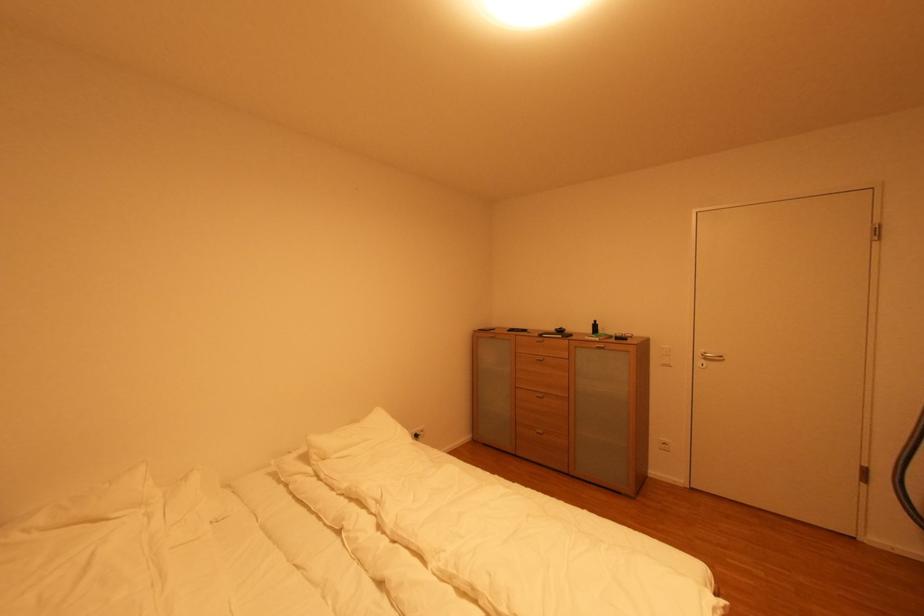
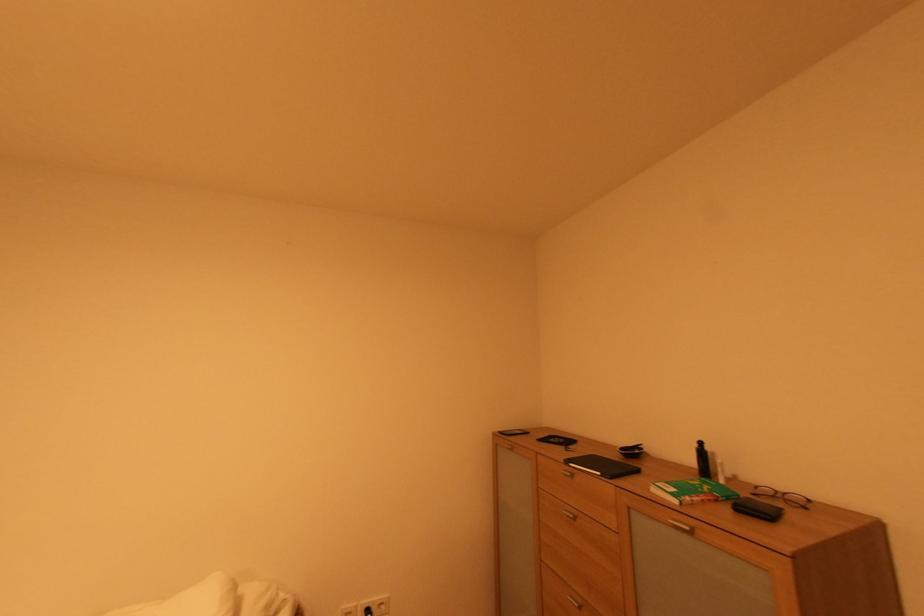
Where in the second image is the point corresponding to (x=609, y=347) from the first image?

(694, 530)